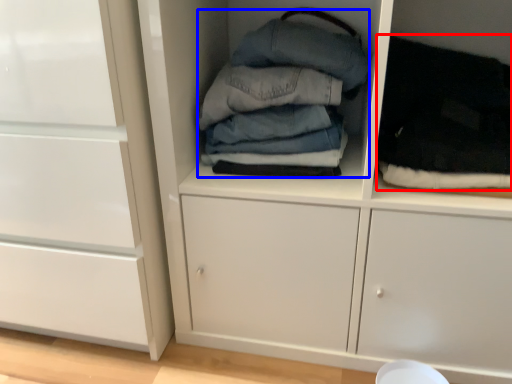
Question: Among these objects, which one is nearest to the camera, clothing (highlighted by a red box) or clothing (highlighted by a blue box)?

Choices:
 (A) clothing
 (B) clothing

Answer: (A)